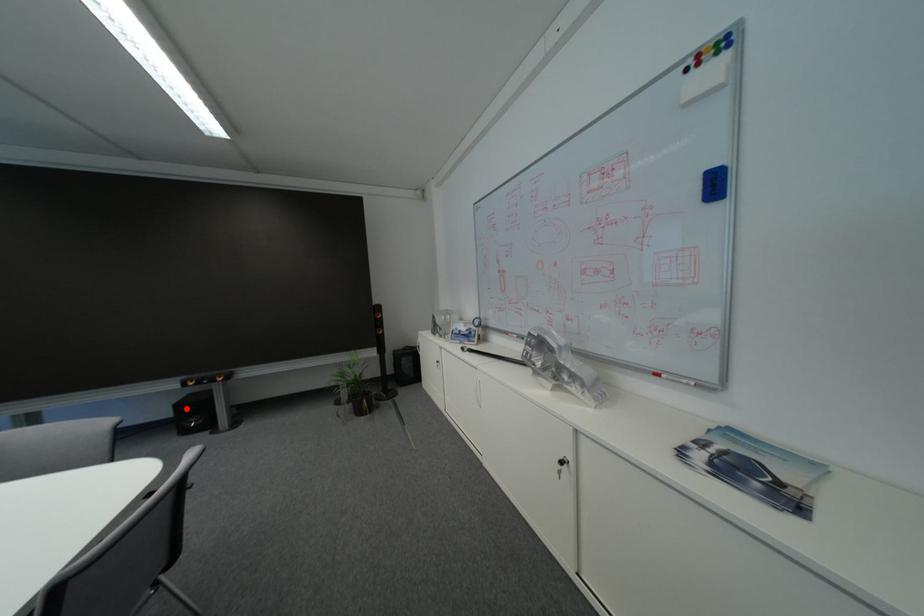
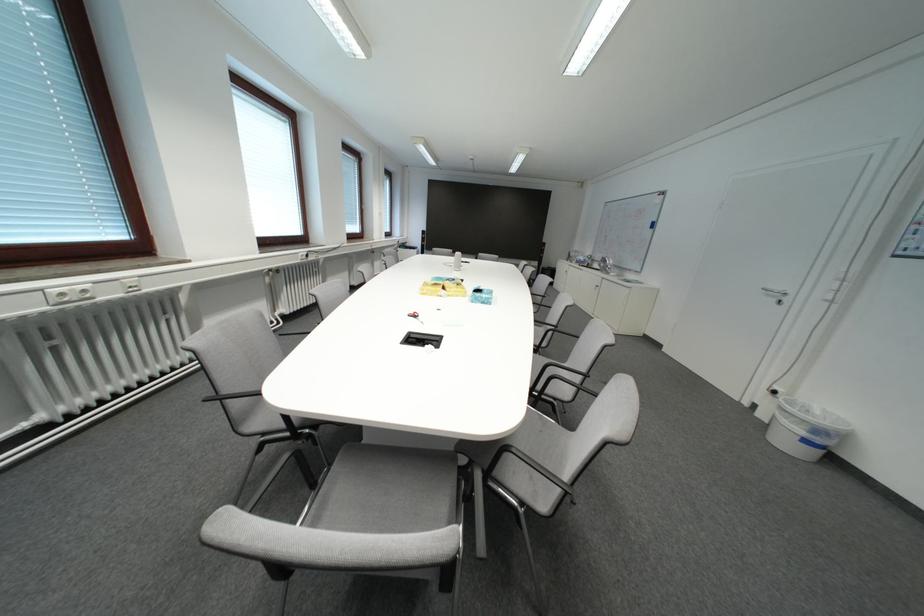
Question: I am providing you with two images of the same scene from different viewpoints. A red point is marked on the first image. Is the red point's position out of view in image 2?

Choices:
 (A) Yes
 (B) No

Answer: (A)